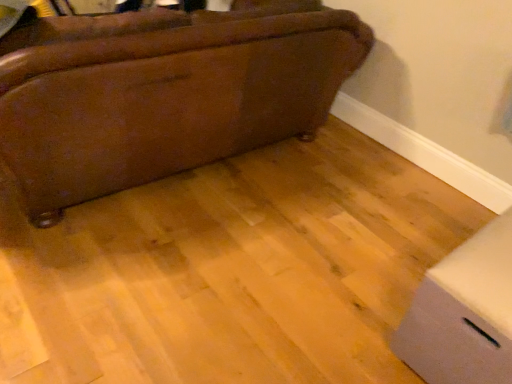
The height and width of the screenshot is (384, 512). Identify the location of white cardboard box at lower right. (464, 313).

What is the approximate width of white cardboard box at lower right?

66.14 centimeters.

In order to face white cardboard box at lower right, should I rotate leftwards or rightwards?

Rotate right and turn 30.100 degrees.

Image resolution: width=512 pixels, height=384 pixels. What do you see at coordinates (464, 313) in the screenshot?
I see `white cardboard box at lower right` at bounding box center [464, 313].

Measure the distance between brown leather couch at upper left and camera.

brown leather couch at upper left is 4.39 feet from camera.

What is the approximate height of brown leather couch at upper left?

It is 35.08 inches.

Locate an element on the screen. brown leather couch at upper left is located at coordinates (167, 101).

The image size is (512, 384). What do you see at coordinates (167, 101) in the screenshot?
I see `brown leather couch at upper left` at bounding box center [167, 101].

Identify the location of white cardboard box at lower right. Image resolution: width=512 pixels, height=384 pixels. (464, 313).

Does brown leather couch at upper left appear on the left side of white cardboard box at lower right?

Yes.

Which is behind, brown leather couch at upper left or white cardboard box at lower right?

brown leather couch at upper left is behind.

Considering the points (112, 60) and (447, 318), which point is in front, point (112, 60) or point (447, 318)?

The point (447, 318) is closer to the camera.

From the image's perspective, relative to white cardboard box at lower right, is brown leather couch at upper left above or below?

Clearly, from the image's perspective, brown leather couch at upper left is above white cardboard box at lower right.

From a real-world perspective, which object rests below the other?

white cardboard box at lower right, from a real-world perspective.

Consider the image. Considering the relative sizes of brown leather couch at upper left and white cardboard box at lower right in the image provided, is brown leather couch at upper left wider than white cardboard box at lower right?

Yes, brown leather couch at upper left is wider than white cardboard box at lower right.

Who is shorter, brown leather couch at upper left or white cardboard box at lower right?

With less height is white cardboard box at lower right.

Considering the relative sizes of brown leather couch at upper left and white cardboard box at lower right in the image provided, is brown leather couch at upper left smaller than white cardboard box at lower right?

No, brown leather couch at upper left is not smaller than white cardboard box at lower right.

Is brown leather couch at upper left situated inside white cardboard box at lower right or outside?

brown leather couch at upper left cannot be found inside white cardboard box at lower right.

Is brown leather couch at upper left far away from white cardboard box at lower right?

brown leather couch at upper left is far away from white cardboard box at lower right.

Could you tell me if brown leather couch at upper left is facing white cardboard box at lower right?

No, brown leather couch at upper left is not aimed at white cardboard box at lower right.

What's the angular difference between brown leather couch at upper left and white cardboard box at lower right's facing directions?

brown leather couch at upper left and white cardboard box at lower right are facing 92.5 degrees away from each other.

This screenshot has width=512, height=384. Find the location of `furniture to the left of white cardboard box at lower right`. furniture to the left of white cardboard box at lower right is located at coordinates (167, 101).

Is white cardboard box at lower right at the right side of brown leather couch at upper left?

Correct, you'll find white cardboard box at lower right to the right of brown leather couch at upper left.

Which object is more forward, white cardboard box at lower right or brown leather couch at upper left?

white cardboard box at lower right.

Is point (472, 328) positioned behind point (249, 57)?

That is False.

From the image's perspective, relative to brown leather couch at upper left, is white cardboard box at lower right above or below?

Clearly, from the image's perspective, white cardboard box at lower right is below brown leather couch at upper left.

From a real-world perspective, is white cardboard box at lower right located beneath brown leather couch at upper left?

Yes, from a real-world perspective, white cardboard box at lower right is below brown leather couch at upper left.

Can you confirm if white cardboard box at lower right is wider than brown leather couch at upper left?

No, white cardboard box at lower right is not wider than brown leather couch at upper left.

Considering the relative sizes of white cardboard box at lower right and brown leather couch at upper left in the image provided, is white cardboard box at lower right taller than brown leather couch at upper left?

No.

Who is smaller, white cardboard box at lower right or brown leather couch at upper left?

With smaller size is white cardboard box at lower right.

Is brown leather couch at upper left surrounded by white cardboard box at lower right?

No, white cardboard box at lower right does not contain brown leather couch at upper left.

Is white cardboard box at lower right next to brown leather couch at upper left and touching it?

white cardboard box at lower right and brown leather couch at upper left are not in contact.

Could you tell me if white cardboard box at lower right is facing brown leather couch at upper left?

No, white cardboard box at lower right is not oriented towards brown leather couch at upper left.

In order to click on cardboard box on the right of the brown leather couch at upper left in this screenshot , I will do `click(464, 313)`.

Locate an element on the screen. furniture lying behind the white cardboard box at lower right is located at coordinates (167, 101).

Image resolution: width=512 pixels, height=384 pixels. What are the coordinates of `furniture on the left of white cardboard box at lower right` in the screenshot? It's located at (167, 101).